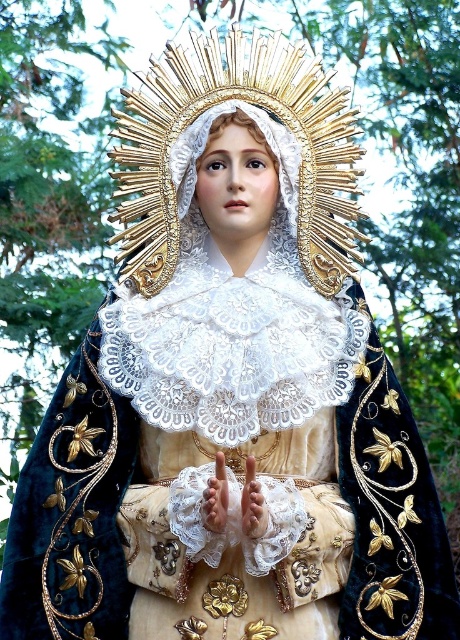
Between gold textured halo at center and smooth white hand at center, which one is positioned higher?

gold textured halo at center

Is gold textured halo at center to the right of smooth white hand at center from the viewer's perspective?

Yes, gold textured halo at center is to the right of smooth white hand at center.

Measure the distance between point (164, 52) and camera.

They are 138.41 meters apart.

Find the location of a particular element. The width and height of the screenshot is (460, 640). gold textured halo at center is located at coordinates coord(220,108).

How distant is smooth white hand at center from gold textured hand at center?

3.04 meters

Locate an element on the screen. This screenshot has height=640, width=460. smooth white hand at center is located at coordinates (216, 497).

Measure the distance between smooth white hand at center and camera.

smooth white hand at center is 68.45 meters from camera.

Find the location of a particular element. smooth white hand at center is located at coordinates (216, 497).

This screenshot has width=460, height=640. In order to click on gold textured halo at center in this screenshot , I will do `click(220, 108)`.

Does point (207, 76) lie behind point (243, 490)?

That is True.

Is point (327, 241) farther from viewer compared to point (256, 500)?

Yes, point (327, 241) is behind point (256, 500).

This screenshot has height=640, width=460. Identify the location of gold textured halo at center. [x=220, y=108].